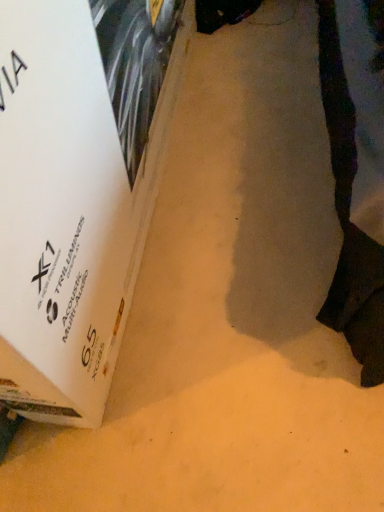
This screenshot has height=512, width=384. Describe the element at coordinates (77, 190) in the screenshot. I see `white cardboard box at lower left` at that location.

Where is `white cardboard box at lower left`? white cardboard box at lower left is located at coordinates 77,190.

Image resolution: width=384 pixels, height=512 pixels. In order to click on white cardboard box at lower left in this screenshot , I will do point(77,190).